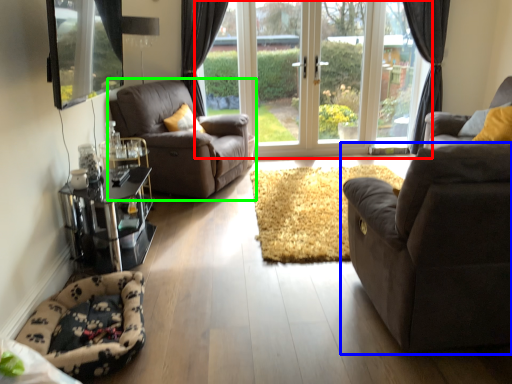
Question: Which is nearer to the door (highlighted by a red box)? studio couch (highlighted by a blue box) or chair (highlighted by a green box).

Choices:
 (A) studio couch
 (B) chair

Answer: (B)